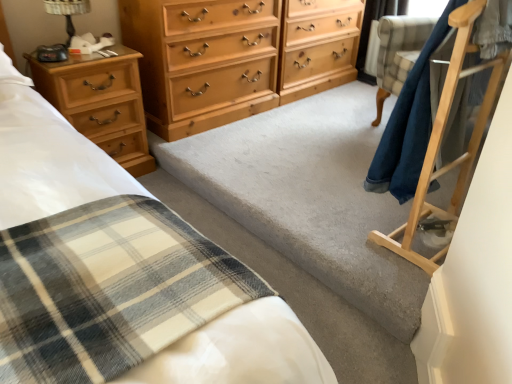
Question: Considering the relative sizes of metallic black table lamp at upper left and light brown wood dresser at center in the image provided, is metallic black table lamp at upper left wider than light brown wood dresser at center?

Choices:
 (A) no
 (B) yes

Answer: (A)

Question: From a real-world perspective, is metallic black table lamp at upper left under light brown wood dresser at center?

Choices:
 (A) no
 (B) yes

Answer: (A)

Question: Is metallic black table lamp at upper left looking in the opposite direction of light brown wood dresser at center?

Choices:
 (A) no
 (B) yes

Answer: (A)

Question: Does metallic black table lamp at upper left have a greater height compared to light brown wood dresser at center?

Choices:
 (A) yes
 (B) no

Answer: (B)

Question: Are metallic black table lamp at upper left and light brown wood dresser at center located far from each other?

Choices:
 (A) no
 (B) yes

Answer: (B)

Question: Is metallic black table lamp at upper left outside light brown wood dresser at center?

Choices:
 (A) yes
 (B) no

Answer: (A)

Question: Considering the relative sizes of metallic black table lamp at upper left and light brown wood chest of drawers at center, the second chest of drawers viewed from the left, in the image provided, is metallic black table lamp at upper left taller than light brown wood chest of drawers at center, the second chest of drawers viewed from the left,?

Choices:
 (A) no
 (B) yes

Answer: (A)

Question: From the image's perspective, is metallic black table lamp at upper left on light brown wood chest of drawers at center, marked as the 1th chest of drawers in a right-to-left arrangement?

Choices:
 (A) no
 (B) yes

Answer: (A)

Question: Is metallic black table lamp at upper left next to light brown wood chest of drawers at center, the second chest of drawers viewed from the left?

Choices:
 (A) no
 (B) yes

Answer: (A)

Question: From the image's perspective, is metallic black table lamp at upper left under light brown wood chest of drawers at center, marked as the 1th chest of drawers in a right-to-left arrangement?

Choices:
 (A) no
 (B) yes

Answer: (B)

Question: Is metallic black table lamp at upper left positioned in front of light brown wood chest of drawers at center, marked as the 1th chest of drawers in a right-to-left arrangement?

Choices:
 (A) yes
 (B) no

Answer: (A)

Question: Considering the relative sizes of metallic black table lamp at upper left and light brown wood chest of drawers at center, the second chest of drawers viewed from the left, in the image provided, is metallic black table lamp at upper left bigger than light brown wood chest of drawers at center, the second chest of drawers viewed from the left,?

Choices:
 (A) yes
 (B) no

Answer: (B)

Question: Considering the relative sizes of light brown wood dresser at center and metallic black table lamp at upper left in the image provided, is light brown wood dresser at center thinner than metallic black table lamp at upper left?

Choices:
 (A) yes
 (B) no

Answer: (B)